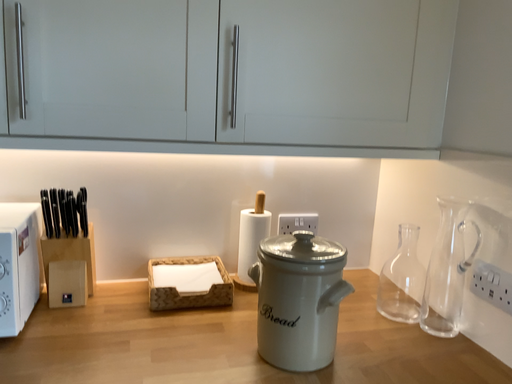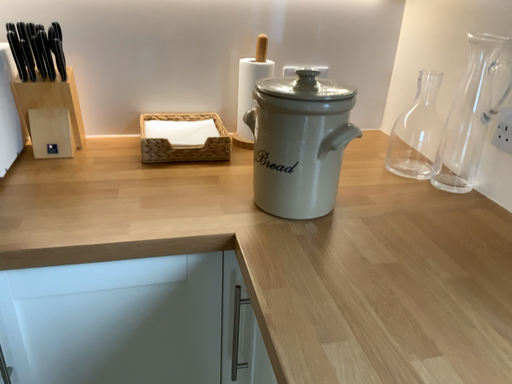
Question: How did the camera likely rotate when shooting the video?

Choices:
 (A) rotated upward
 (B) rotated downward

Answer: (B)